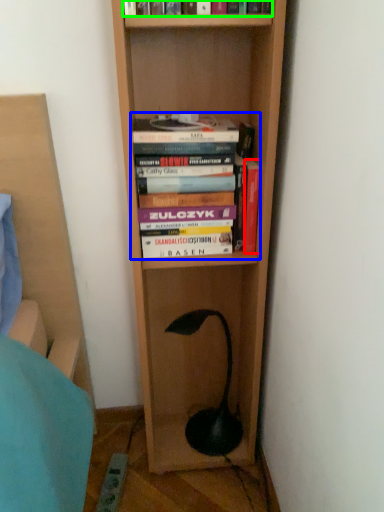
Question: Estimate the real-world distances between objects in this image. Which object is closer to book (highlighted by a red box), book (highlighted by a blue box) or book (highlighted by a green box)?

Choices:
 (A) book
 (B) book

Answer: (A)